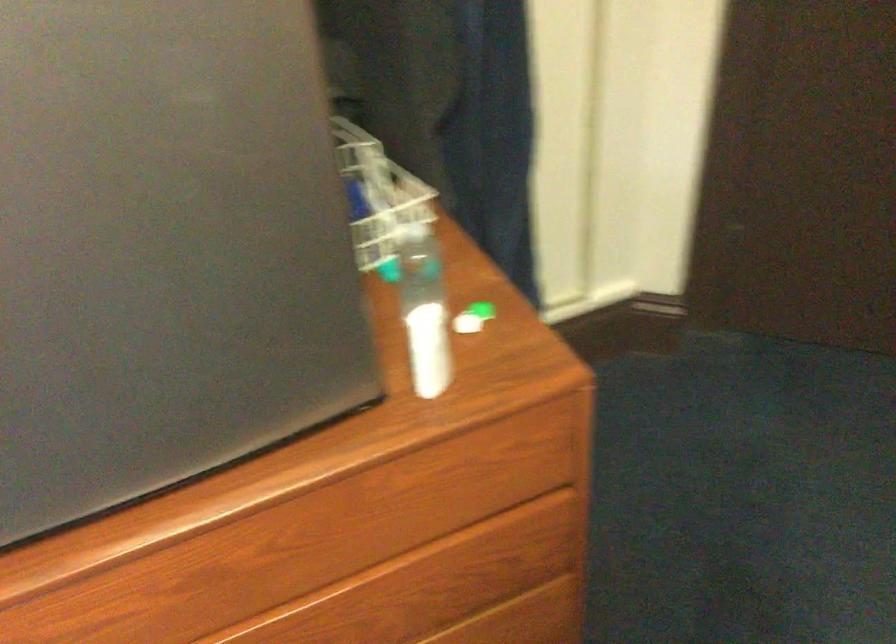
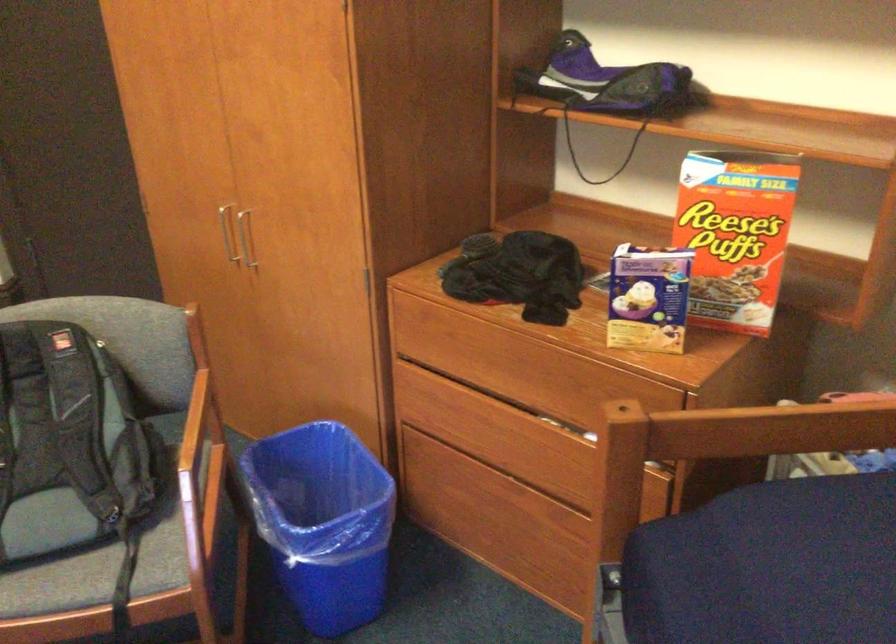
What movement of the cameraman would produce the second image?

The movement direction of the cameraman is right, backward.